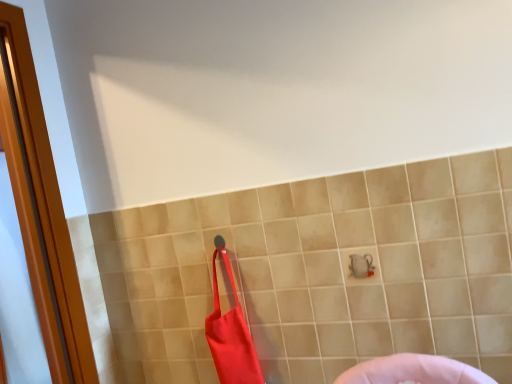
I want to click on matte wood door at left, so click(x=41, y=208).

In order to face matte wood door at left, should I rotate leftwards or rightwards?

Turn left by 31.186 degrees to look at matte wood door at left.

Describe the element at coordinates (41, 208) in the screenshot. I see `matte wood door at left` at that location.

You are a GUI agent. You are given a task and a screenshot of the screen. Output one action in this format:
    pyautogui.click(x=<x>, y=<y>)
    Task: Click on the matte wood door at left
    Image resolution: width=512 pixels, height=384 pixels.
    Given the screenshot: What is the action you would take?
    pyautogui.click(x=41, y=208)